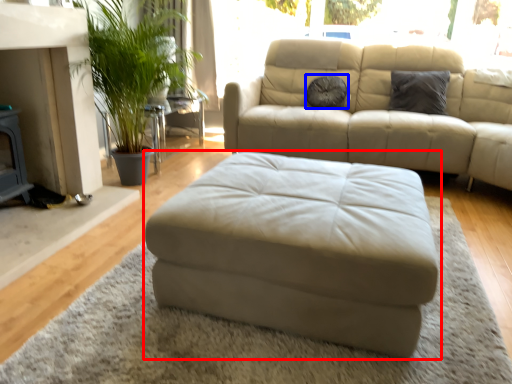
Question: Which object appears farthest to the camera in this image, studio couch (highlighted by a red box) or pillow (highlighted by a blue box)?

Choices:
 (A) studio couch
 (B) pillow

Answer: (B)